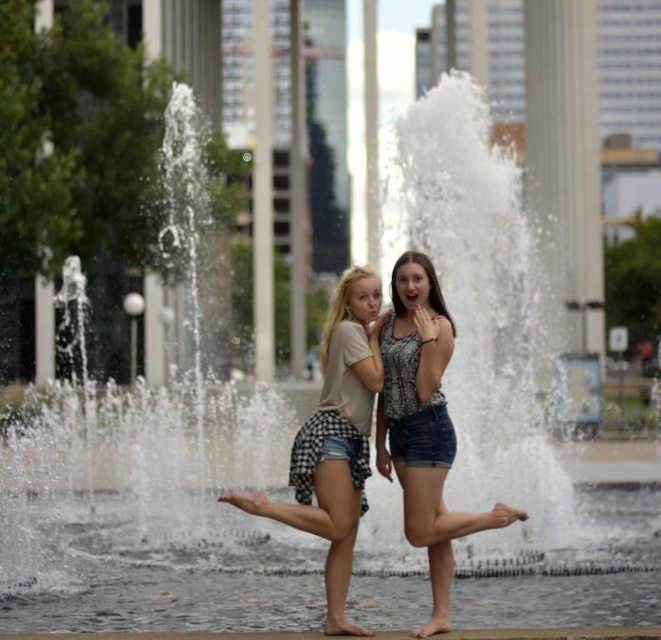
Question: Among these objects, which one is nearest to the camera?

Choices:
 (A) checkered denim shorts at center
 (B) patterned fabric top at center

Answer: (B)

Question: Can you confirm if patterned fabric top at center is smaller than checkered denim shorts at center?

Choices:
 (A) no
 (B) yes

Answer: (B)

Question: Which object appears closest to the camera in this image?

Choices:
 (A) checkered denim shorts at center
 (B) patterned fabric top at center

Answer: (B)

Question: Is patterned fabric top at center to the left of checkered denim shorts at center from the viewer's perspective?

Choices:
 (A) yes
 (B) no

Answer: (B)

Question: Can you confirm if patterned fabric top at center is positioned to the right of checkered denim shorts at center?

Choices:
 (A) yes
 (B) no

Answer: (A)